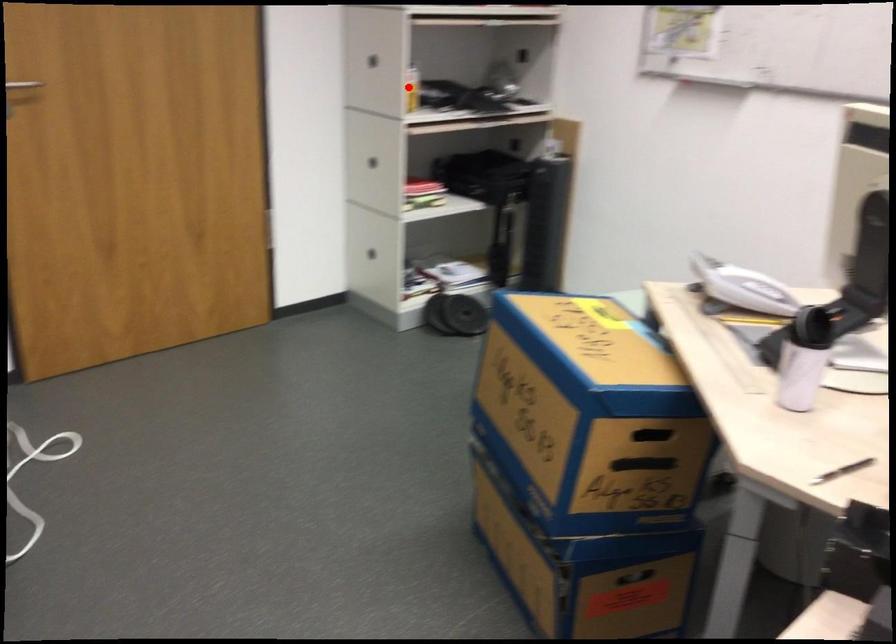
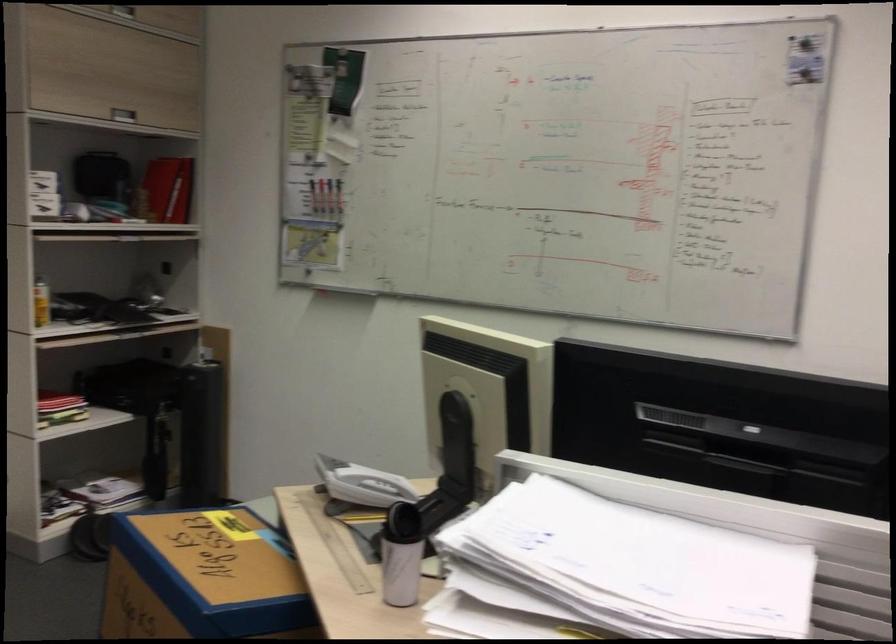
Locate, in the second image, the point that corresponds to the highlighted location in the first image.

(40, 303)